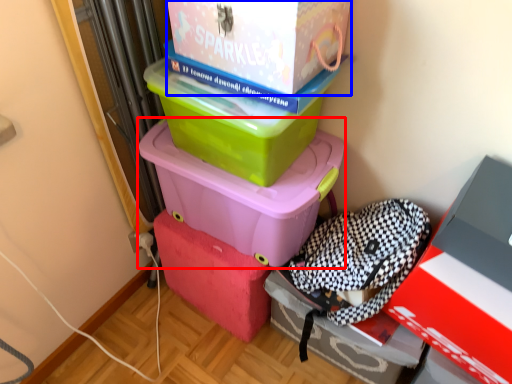
Question: Which point is closer to the camera, box (highlighted by a red box) or box (highlighted by a blue box)?

Choices:
 (A) box
 (B) box

Answer: (B)